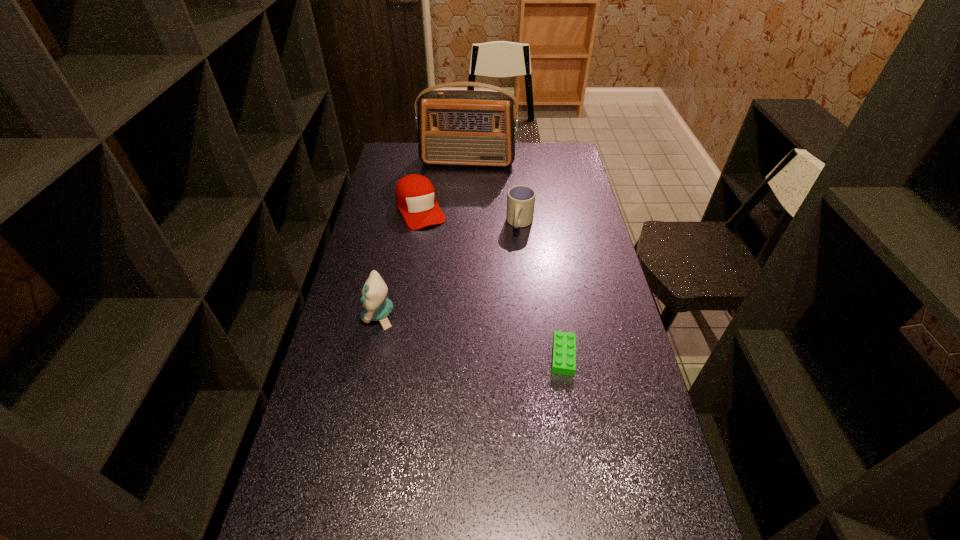
Find the location of a particular element. The width and height of the screenshot is (960, 540). vacant area between the kitten and the baseball cap is located at coordinates (399, 262).

Where is `vacant space that's between the baseball cap and the nearest object`? Image resolution: width=960 pixels, height=540 pixels. vacant space that's between the baseball cap and the nearest object is located at coordinates (492, 282).

At what (x,y) coordinates should I click in order to perform the action: click on free space between the cup and the nearest object. Please return your answer as a coordinate pair (x, y). The width and height of the screenshot is (960, 540). Looking at the image, I should click on (541, 290).

I want to click on free point between the fourth farthest object and the tallest object, so click(x=423, y=238).

You are a GUI agent. You are given a task and a screenshot of the screen. Output one action in this format:
    pyautogui.click(x=<x>, y=<y>)
    Task: Click on the vacant area that lies between the radio receiver and the cup
    
    Given the screenshot: What is the action you would take?
    pyautogui.click(x=493, y=192)

Where is `vacant area that lies between the second nearest object and the baseball cap`? vacant area that lies between the second nearest object and the baseball cap is located at coordinates (399, 262).

The width and height of the screenshot is (960, 540). Identify the location of empty location between the radio receiver and the second nearest object. (423, 238).

Image resolution: width=960 pixels, height=540 pixels. What are the coordinates of `the closest object to the kitten` in the screenshot? It's located at (415, 196).

Where is `the third closest object relative to the tallest object`? The width and height of the screenshot is (960, 540). the third closest object relative to the tallest object is located at coordinates (377, 307).

Locate an element on the screen. free space in the image that satisfies the following two spatial constraints: 1. on the back side of the tallest object; 2. on the right side of the baseball cap is located at coordinates coord(428,161).